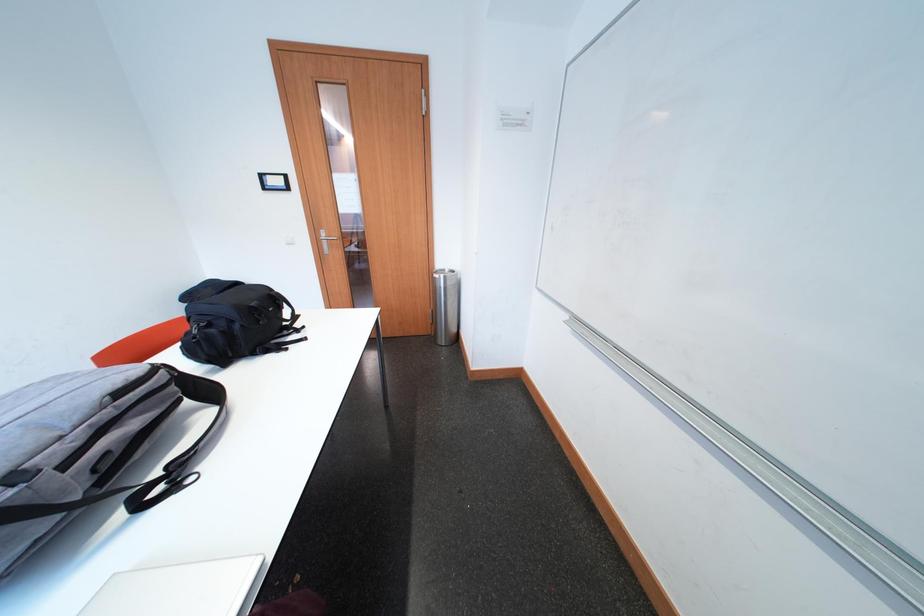
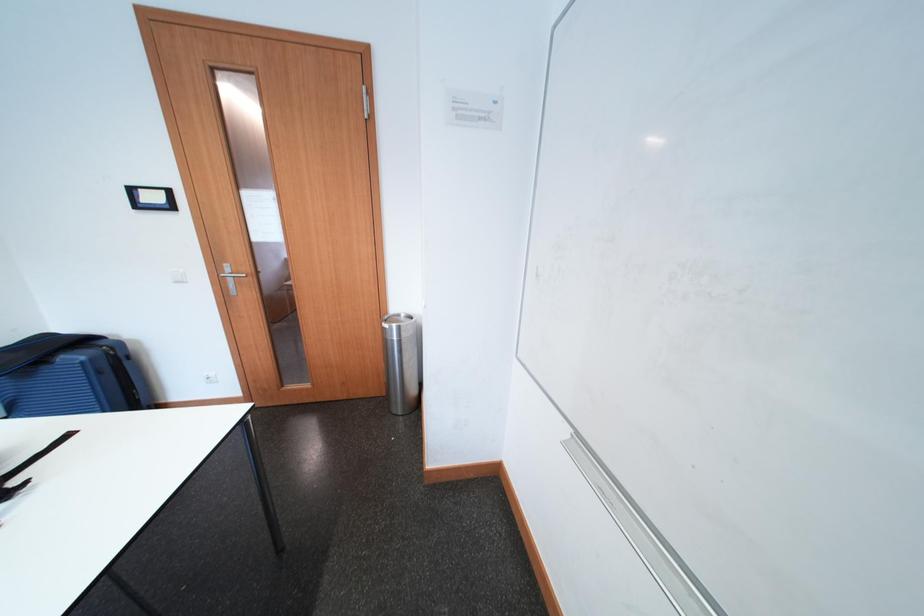
The images are taken continuously from a first-person perspective. In which direction are you moving?

The cameraman walked toward right, forward.